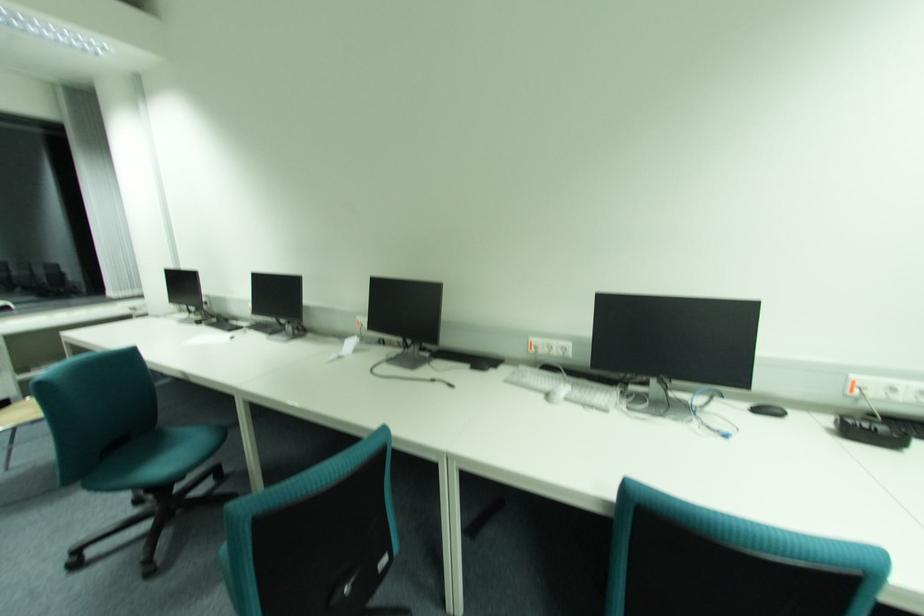
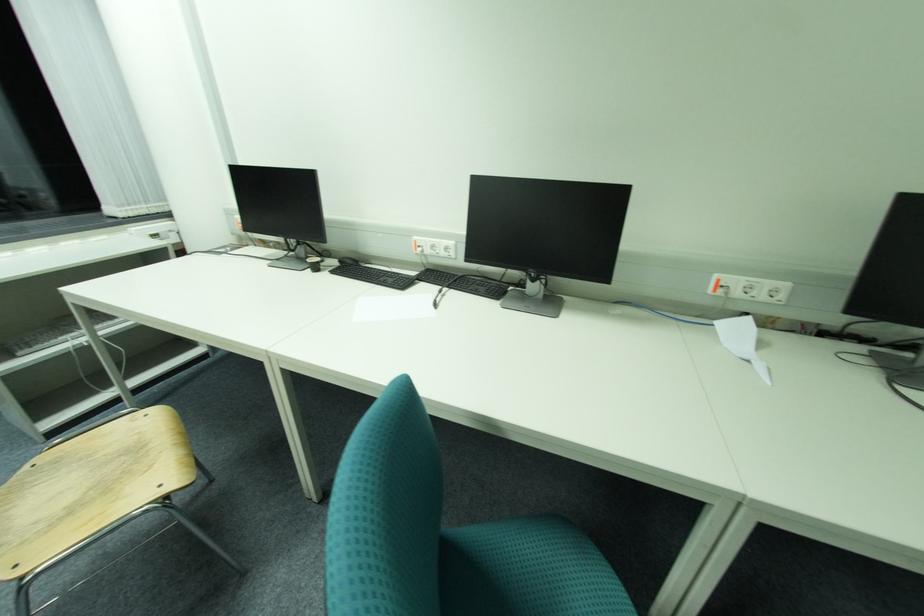
In a continuous first-person perspective shot, in which direction is the camera moving?

The cameraman moved toward left, forward.